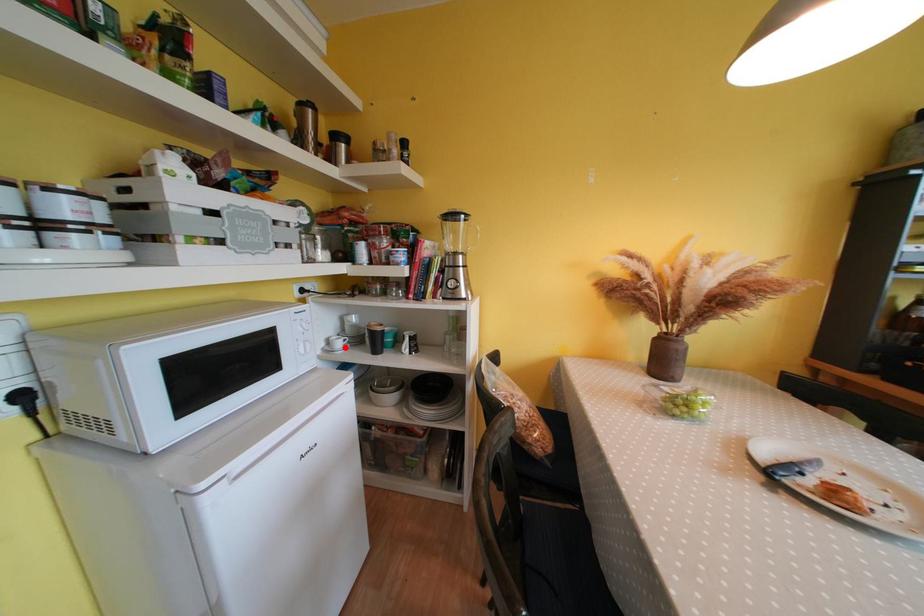
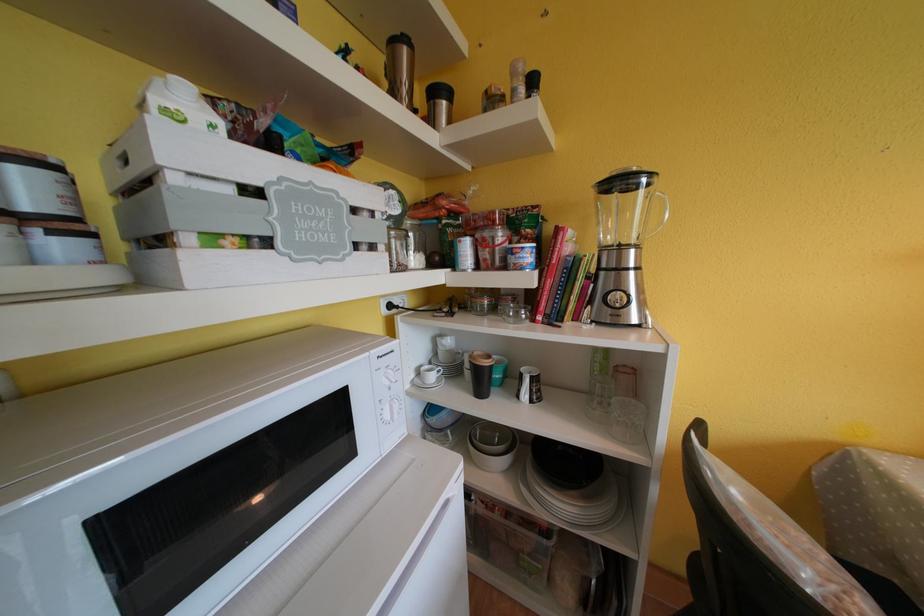
Find the pixel in the second image that matches the highlighted location in the first image.

(439, 381)